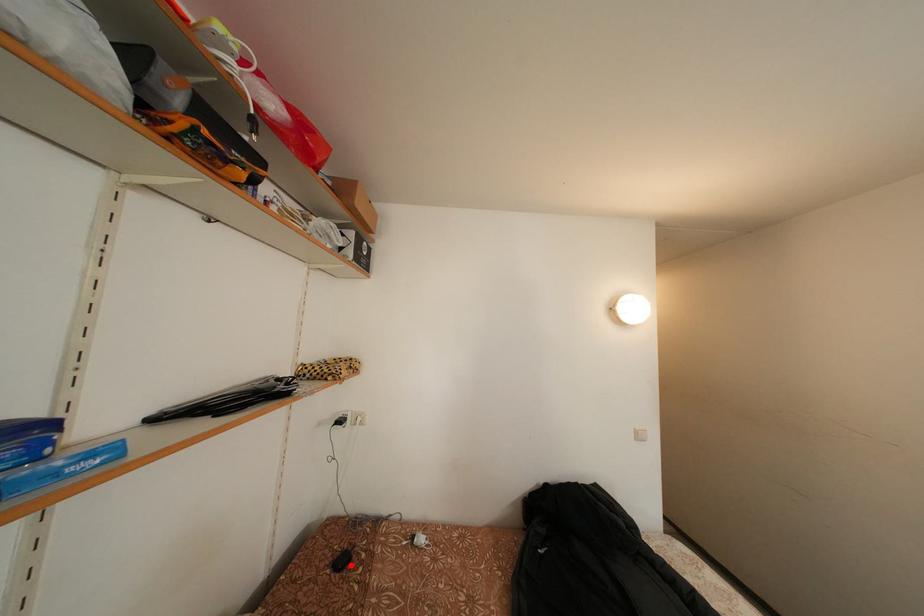
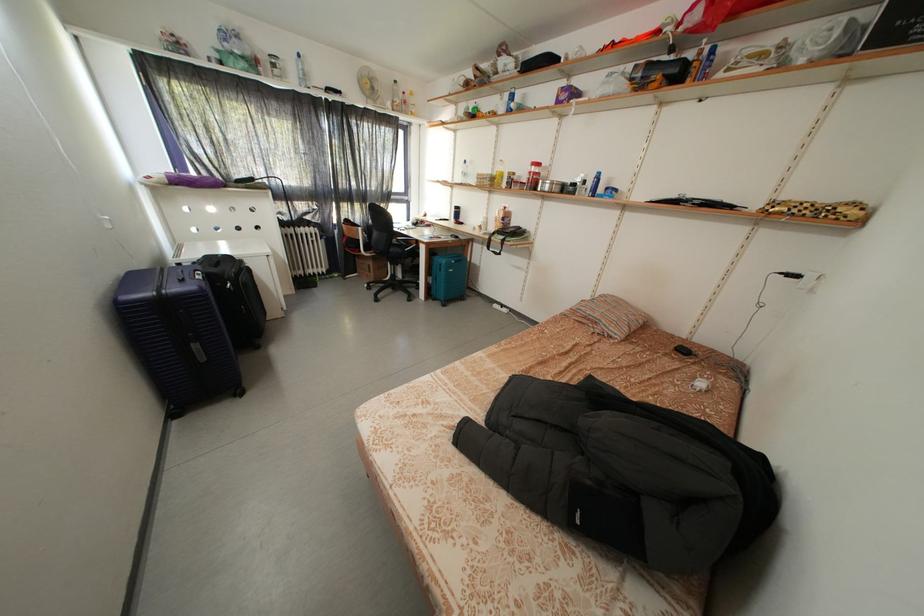
Locate, in the second image, the point that corresponds to the highlighted location in the first image.

(691, 355)